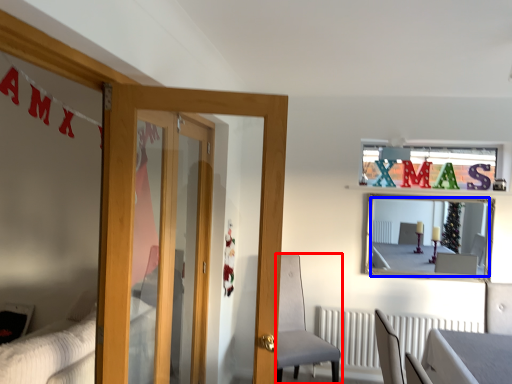
Question: Which of the following is the farthest to the observer, chair (highlighted by a red box) or mirror (highlighted by a blue box)?

Choices:
 (A) chair
 (B) mirror

Answer: (B)